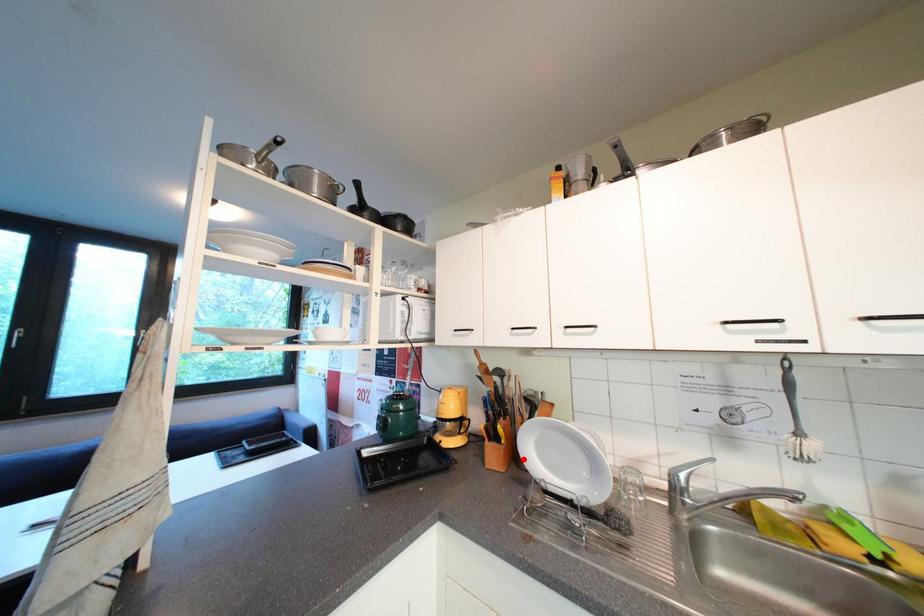
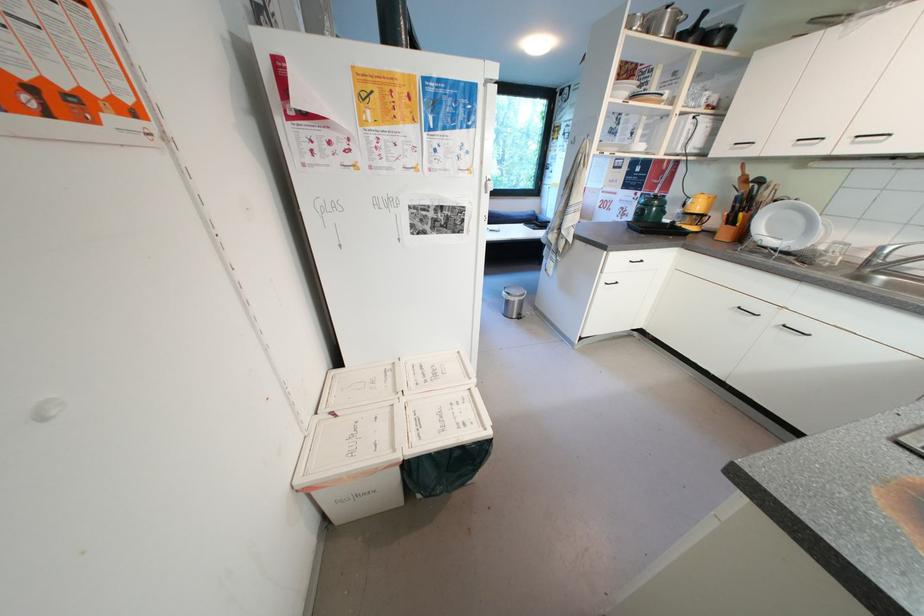
Locate, in the second image, the point that corresponds to the highlighted location in the first image.

(749, 238)